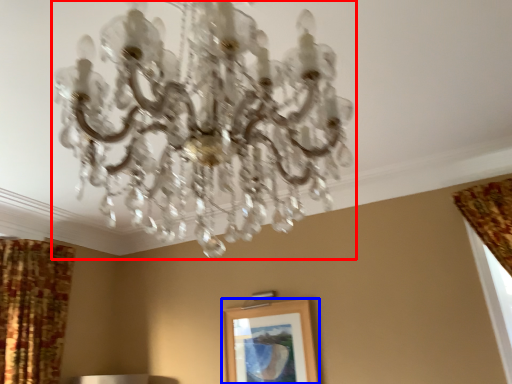
Question: Which of the following is the closest to the observer, lamp (highlighted by a red box) or picture frame (highlighted by a blue box)?

Choices:
 (A) lamp
 (B) picture frame

Answer: (A)